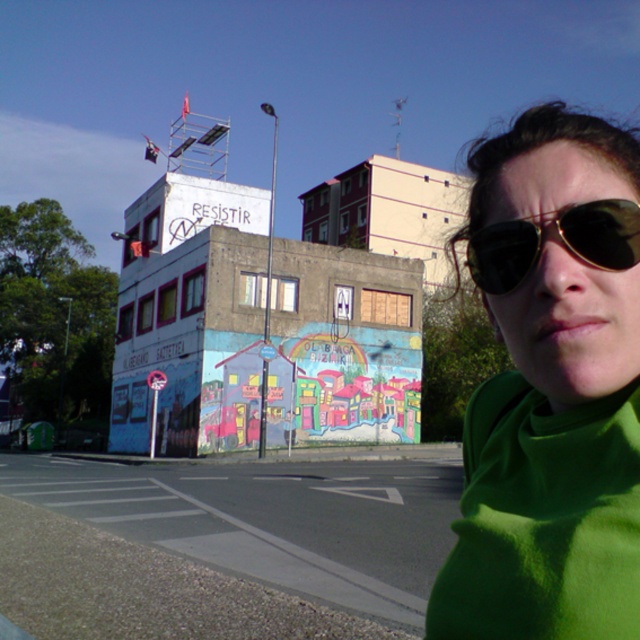
Can you confirm if green fleece at center is smaller than gold reflective sunglasses at right?

Actually, green fleece at center might be larger than gold reflective sunglasses at right.

Which is behind, point (476, 396) or point (624, 204)?

The point (476, 396) is more distant.

The height and width of the screenshot is (640, 640). What are the coordinates of `green fleece at center` in the screenshot? It's located at (552, 388).